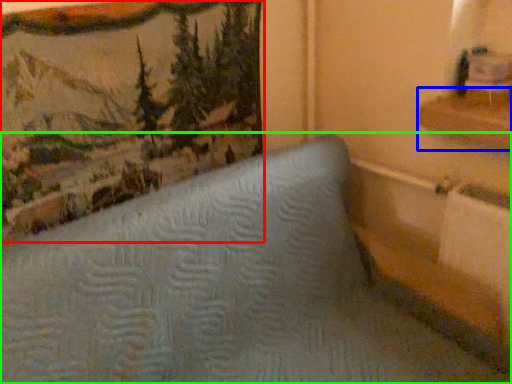
Question: Based on their relative distances, which object is nearer to picture frame (highlighted by a red box)? Choose from shelf (highlighted by a blue box) and furniture (highlighted by a green box).

Choices:
 (A) shelf
 (B) furniture

Answer: (B)